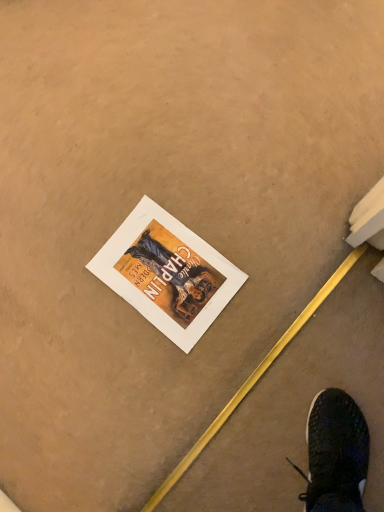
Question: Should I look upward or downward to see matte paper poster at center?

Choices:
 (A) down
 (B) up

Answer: (A)